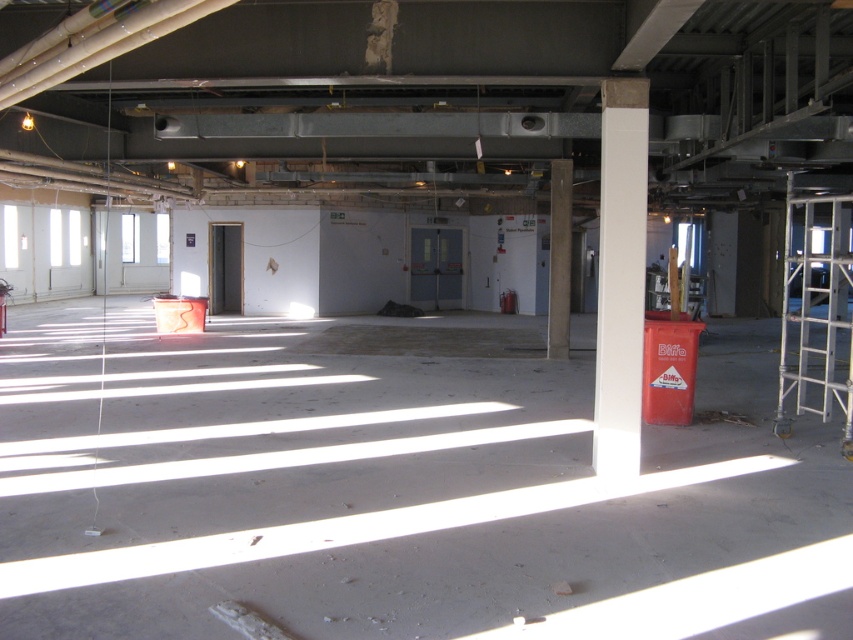
Question: Is white smooth column at right below white marble pillar at center?

Choices:
 (A) yes
 (B) no

Answer: (A)

Question: Can you confirm if white smooth column at right is positioned above white marble pillar at center?

Choices:
 (A) yes
 (B) no

Answer: (B)

Question: Is white smooth column at right bigger than white marble pillar at center?

Choices:
 (A) no
 (B) yes

Answer: (A)